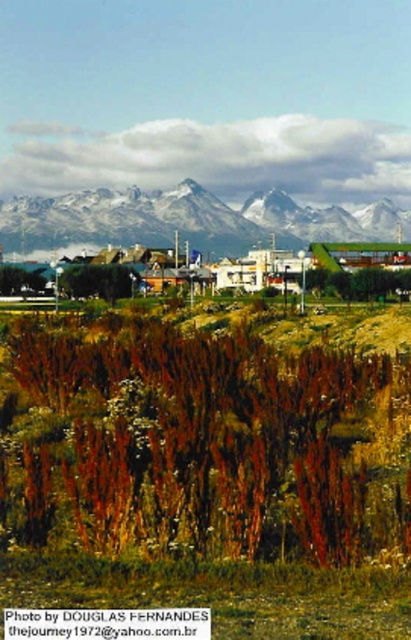
Measure the distance between brown grass at lower center and camera.

brown grass at lower center is 12.96 meters from camera.

At what (x,y) coordinates should I click in order to perform the action: click on brown grass at lower center. Please return your answer as a coordinate pair (x, y). The height and width of the screenshot is (640, 411). Looking at the image, I should click on (200, 442).

Is snowy granite mountain range at upper center bigger than white matte building at center?

No.

Can you confirm if snowy granite mountain range at upper center is taller than white matte building at center?

Correct, snowy granite mountain range at upper center is much taller as white matte building at center.

You are a GUI agent. You are given a task and a screenshot of the screen. Output one action in this format:
    pyautogui.click(x=<x>, y=<y>)
    Task: Click on the snowy granite mountain range at upper center
    This screenshot has width=411, height=640.
    Given the screenshot: What is the action you would take?
    pyautogui.click(x=187, y=220)

Does brown grass at lower center appear on the right side of white matte building at center?

Incorrect, brown grass at lower center is not on the right side of white matte building at center.

Is brown grass at lower center thinner than white matte building at center?

Yes, brown grass at lower center is thinner than white matte building at center.

The width and height of the screenshot is (411, 640). Describe the element at coordinates (200, 442) in the screenshot. I see `brown grass at lower center` at that location.

I want to click on brown grass at lower center, so click(200, 442).